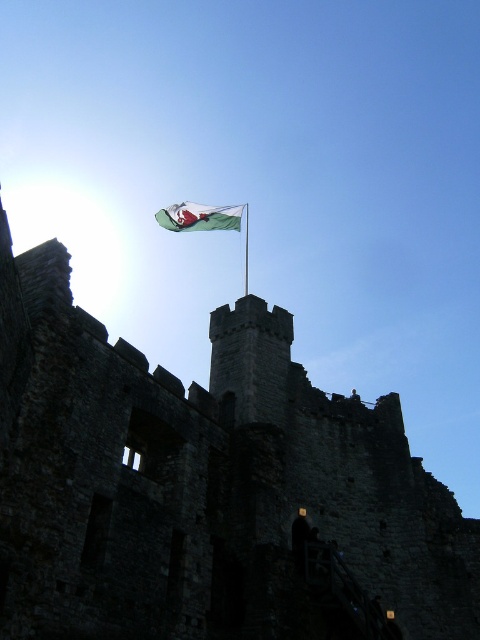
You are standing in a field looking at the historic stone castle. If you want to take a photo of the dark stone castle at upper center, where should you aim your camera? Please provide coordinates in the format of x,y between 0 and 1, where 0 is the left edge and 1 is the right edge, and 0 is the bottom edge and 1 is the top edge.

You should aim your camera at coordinates (x=206, y=486) to capture the dark stone castle at upper center.

You are a tourist standing in front of the dark stone castle at upper center. You notice the green fabric flag at upper center. Which object is higher in the image?

The green fabric flag at upper center is higher because it is located above the dark stone castle at upper center.

You are a tour guide explaining the castle to visitors. You mention the green fabric flag at upper center and the green fabric flagpole at upper center. Which of these two items is wider?

The green fabric flag at upper center is wider than the green fabric flagpole at upper center.